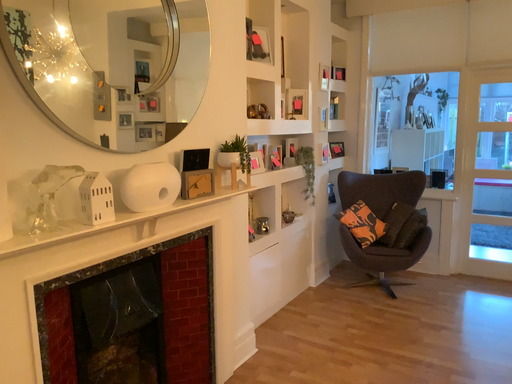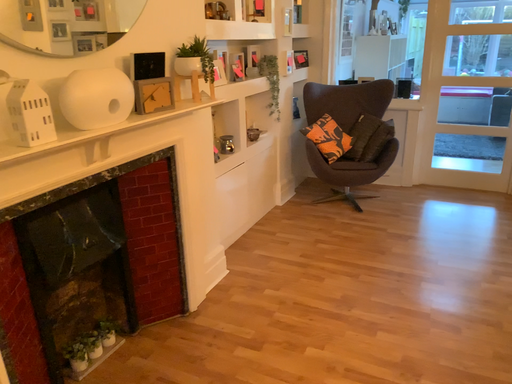
Question: Which way did the camera rotate in the video?

Choices:
 (A) rotated left
 (B) rotated right

Answer: (B)